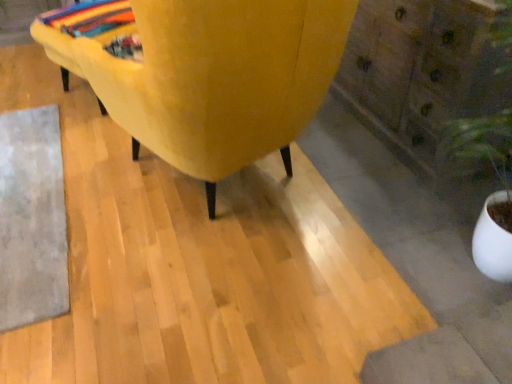
Image resolution: width=512 pixels, height=384 pixels. What are the coordinates of `free location to the right of gray woolen mat at lower left` in the screenshot? It's located at point(205,226).